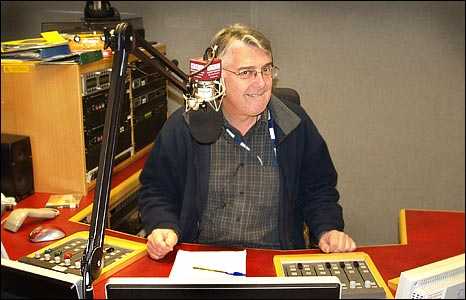
Find the location of `audio level adjuster`. audio level adjuster is located at coordinates click(68, 244), click(336, 268).